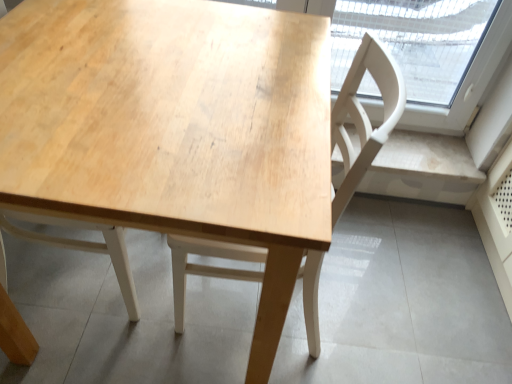
Question: Could you tell me if natural wood table at center is turned towards light wood chair at center?

Choices:
 (A) yes
 (B) no

Answer: (B)

Question: Does natural wood table at center contain light wood chair at center?

Choices:
 (A) yes
 (B) no

Answer: (A)

Question: Can you confirm if natural wood table at center is shorter than light wood chair at center?

Choices:
 (A) no
 (B) yes

Answer: (B)

Question: Considering the relative sizes of natural wood table at center and light wood chair at center in the image provided, is natural wood table at center smaller than light wood chair at center?

Choices:
 (A) yes
 (B) no

Answer: (B)

Question: Is the position of natural wood table at center more distant than that of light wood chair at center?

Choices:
 (A) yes
 (B) no

Answer: (B)

Question: From the image's perspective, does natural wood table at center appear lower than light wood chair at center?

Choices:
 (A) no
 (B) yes

Answer: (A)

Question: From a real-world perspective, is light wood chair at center positioned under natural wood table at center based on gravity?

Choices:
 (A) yes
 (B) no

Answer: (B)

Question: Can you confirm if light wood chair at center is positioned to the right of natural wood table at center?

Choices:
 (A) no
 (B) yes

Answer: (B)

Question: Considering the relative sizes of light wood chair at center and natural wood table at center in the image provided, is light wood chair at center wider than natural wood table at center?

Choices:
 (A) no
 (B) yes

Answer: (A)

Question: Is light wood chair at center far away from natural wood table at center?

Choices:
 (A) yes
 (B) no

Answer: (B)

Question: Can you confirm if light wood chair at center is taller than natural wood table at center?

Choices:
 (A) no
 (B) yes

Answer: (B)

Question: Is light wood chair at center facing away from natural wood table at center?

Choices:
 (A) yes
 (B) no

Answer: (A)

Question: From the image's perspective, relative to light wood chair at center, is natural wood table at center above or below?

Choices:
 (A) below
 (B) above

Answer: (B)